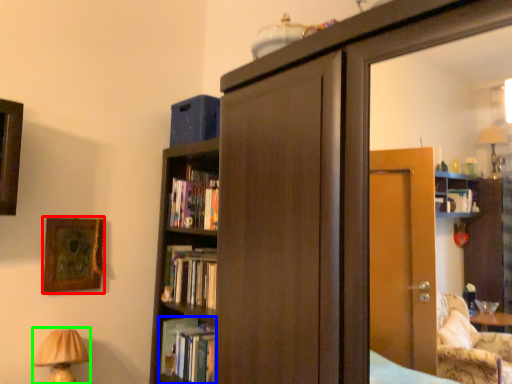
Question: Which is nearer to the picture frame (highlighted by a red box)? book (highlighted by a blue box) or table lamp (highlighted by a green box).

Choices:
 (A) book
 (B) table lamp

Answer: (B)